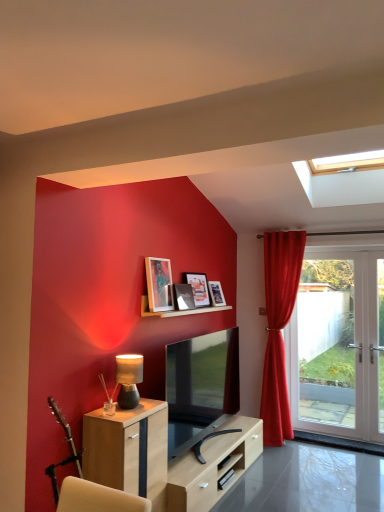
Question: Looking at the image, does white glass door at right seem bigger or smaller compared to light wood cabinet at lower left?

Choices:
 (A) big
 (B) small

Answer: (A)

Question: Considering the relative positions of white glass door at right and light wood cabinet at lower left in the image provided, is white glass door at right to the left or to the right of light wood cabinet at lower left?

Choices:
 (A) right
 (B) left

Answer: (A)

Question: Which of these objects is positioned farthest from the velvet red curtain at right?

Choices:
 (A) matte black table lamp at lower left
 (B) wooden picture frame at upper center, placed as the 4th picture frame when sorted from back to front
 (C) wooden shelf at upper center
 (D) matte glass picture frame at upper center, which is counted as the second picture frame, starting from the front
 (E) matte wooden picture frame at upper center, which appears as the 1th picture frame when viewed from the back

Answer: (A)

Question: Based on their relative distances, which object is farther from the matte glass picture frame at upper center, which appears as the 3th picture frame when viewed from the back?

Choices:
 (A) matte wooden picture frame at upper center, which appears as the 1th picture frame when viewed from the back
 (B) wooden picture frame at upper center, the 1th picture frame when ordered from front to back
 (C) white glass door at right
 (D) matte black table lamp at lower left
 (E) matte wooden picture frame at upper center, acting as the second picture frame starting from the back

Answer: (C)